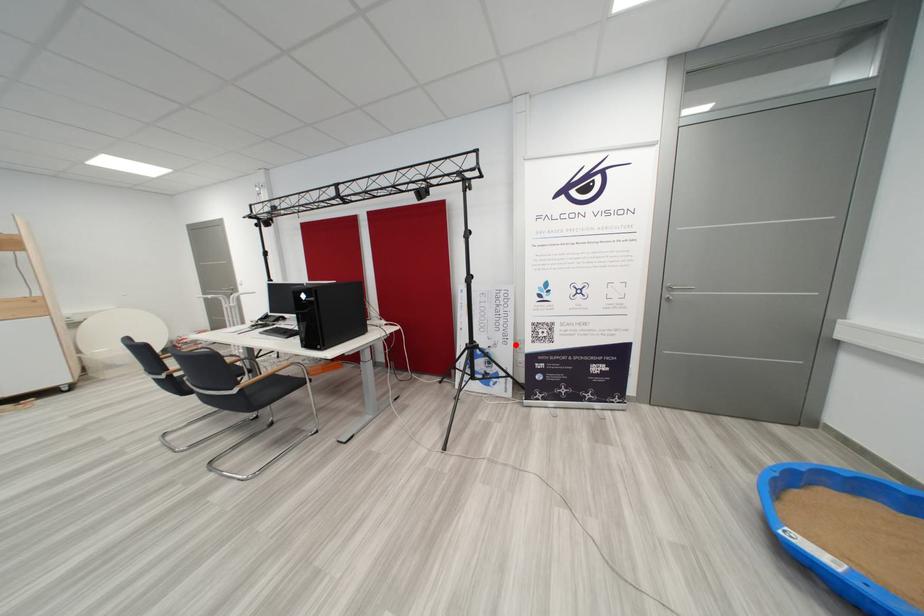
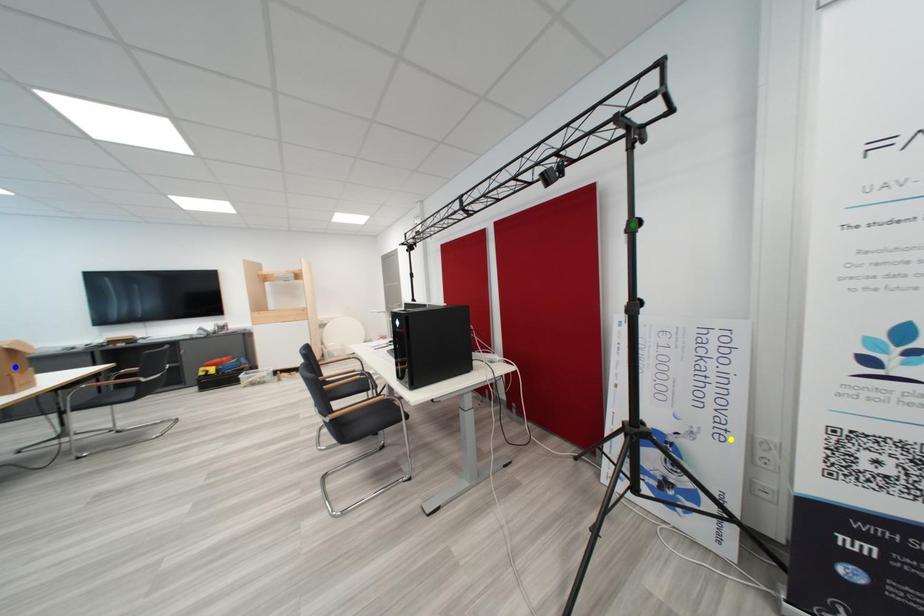
Question: I am providing you with two images of the same scene from different viewpoints. A red point is marked on the first image. You are given multiple points on the second image. In image 2, which mark is for the same physical point as the one in image 1?

Choices:
 (A) green point
 (B) blue point
 (C) yellow point

Answer: (C)